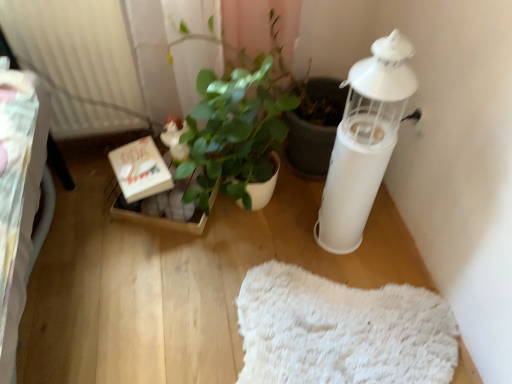
Identify the location of free space above white cardboard box at center, arranged as the 1th cardboard box when viewed from the front (from a real-world perspective). The image size is (512, 384). (143, 158).